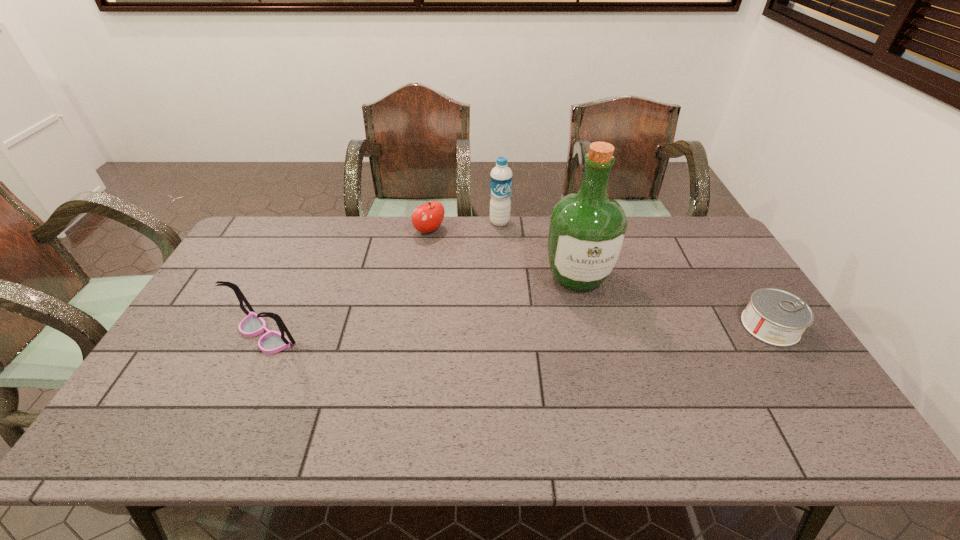
The height and width of the screenshot is (540, 960). I want to click on object that stands as the fourth closest to the second tallest object, so click(776, 317).

Locate an element on the screen. This screenshot has height=540, width=960. object that can be found as the second closest to the rightmost object is located at coordinates (501, 175).

Where is `vacant space that satisfies the following two spatial constraints: 1. on the front side of the rightmost object; 2. on the left side of the third object from left to right`? Image resolution: width=960 pixels, height=540 pixels. vacant space that satisfies the following two spatial constraints: 1. on the front side of the rightmost object; 2. on the left side of the third object from left to right is located at coordinates (506, 326).